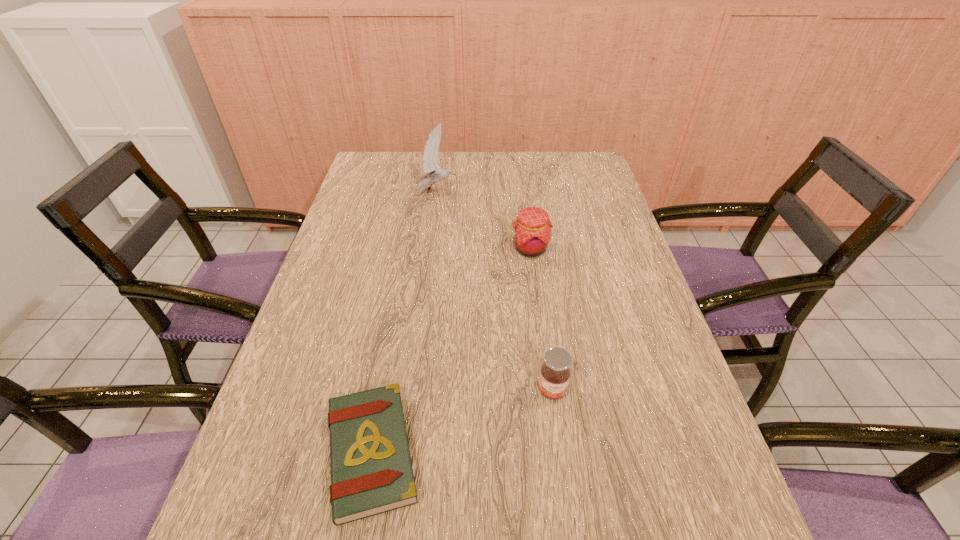
Where is `the tallest object`? The width and height of the screenshot is (960, 540). the tallest object is located at coordinates (433, 173).

Locate an element on the screen. This screenshot has width=960, height=540. gull is located at coordinates (433, 173).

Locate an element on the screen. The height and width of the screenshot is (540, 960). the third nearest object is located at coordinates [532, 229].

The image size is (960, 540). Find the location of `the nearer jam`. the nearer jam is located at coordinates (555, 373).

Identify the location of book. (371, 470).

Find the location of `blank space located 0.330m at the tip of the beak of the farthest object`. blank space located 0.330m at the tip of the beak of the farthest object is located at coordinates (554, 192).

Find the location of `vacant position located on the left of the second farthest object`. vacant position located on the left of the second farthest object is located at coordinates (487, 249).

Locate an element on the screen. vacant area situated 0.240m on the label side of the nearer jam is located at coordinates (571, 531).

Identify the location of vacant region located on the right of the shortest object. (592, 452).

You are a GUI agent. You are given a task and a screenshot of the screen. Output one action in this format:
    pyautogui.click(x=<x>, y=<y>)
    Task: Click on the object that is at the far edge
    The width and height of the screenshot is (960, 540).
    Given the screenshot: What is the action you would take?
    pyautogui.click(x=433, y=173)